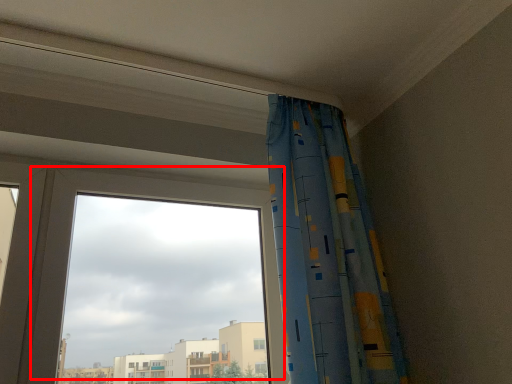
Question: From the image's perspective, where is window (annotated by the red box) located in relation to curtain in the image?

Choices:
 (A) below
 (B) above

Answer: (A)